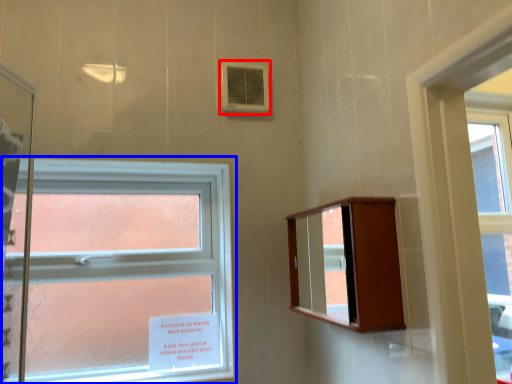
Question: Which point is further to the camera, air conditioning (highlighted by a red box) or window (highlighted by a blue box)?

Choices:
 (A) air conditioning
 (B) window

Answer: (A)